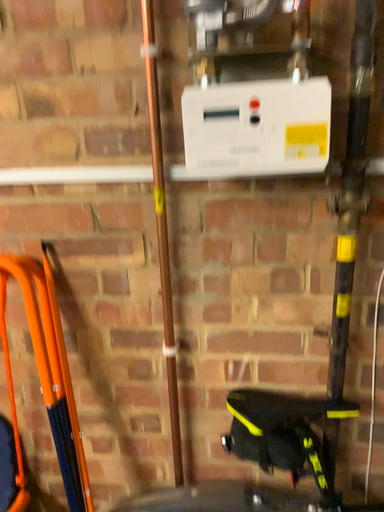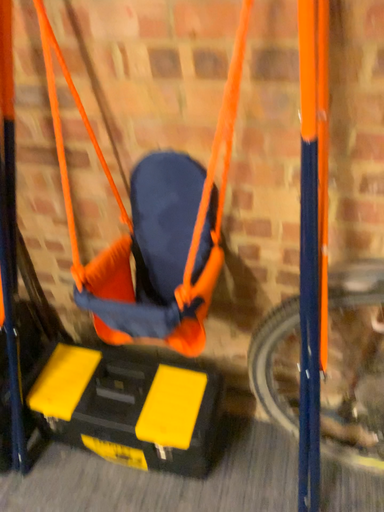
Question: Which way did the camera rotate in the video?

Choices:
 (A) rotated upward
 (B) rotated downward

Answer: (B)